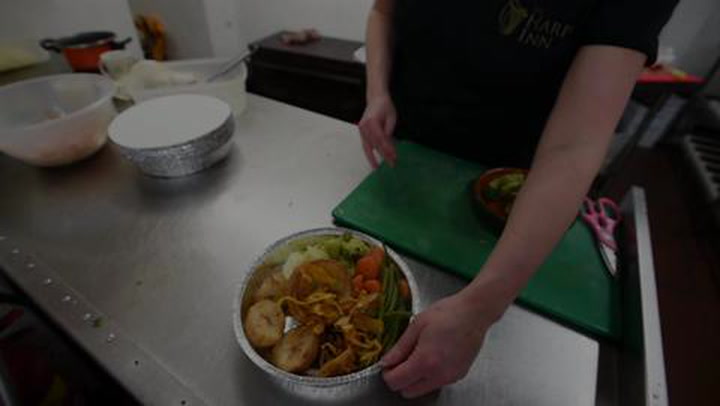
Where is `green cutting board`? green cutting board is located at coordinates (410, 228).